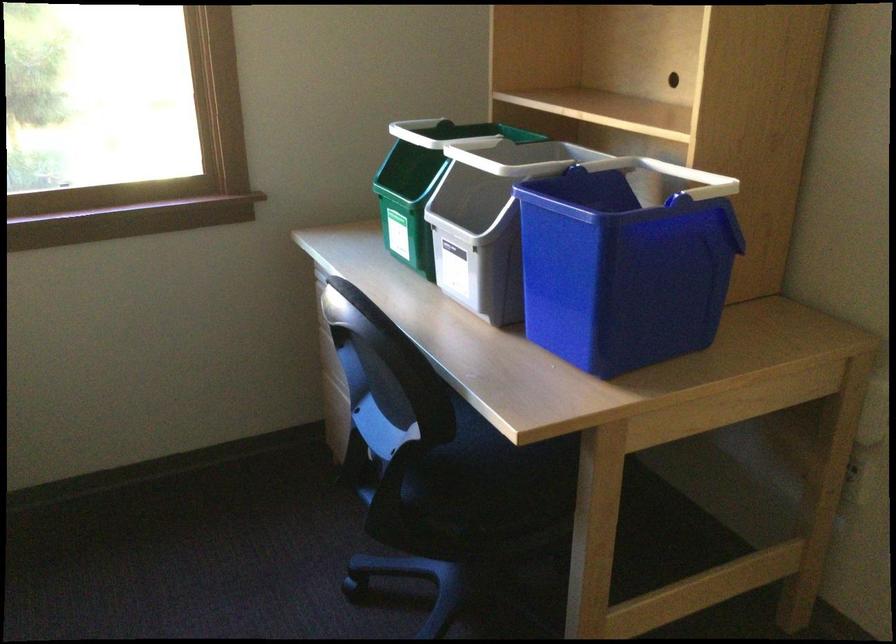
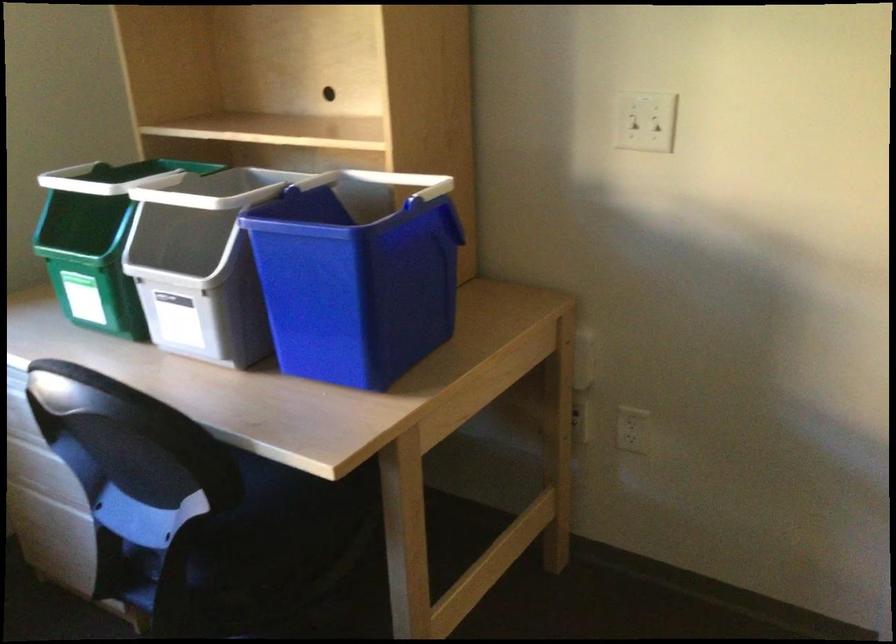
Locate, in the second image, the point that corresponds to point 553,156 in the first image.

(245, 185)